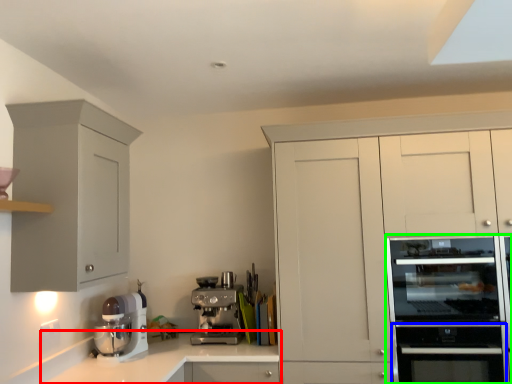
Question: Which object is positioned farthest from countertop (highlighted by a red box)? Select from oven (highlighted by a blue box) and home appliance (highlighted by a green box).

Choices:
 (A) oven
 (B) home appliance

Answer: (B)